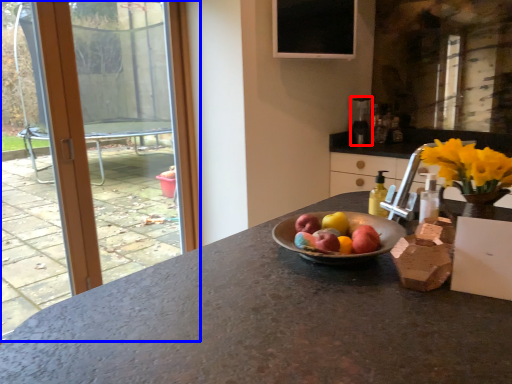
Question: Which point is closer to the camera, appliance (highlighted by a red box) or window (highlighted by a blue box)?

Choices:
 (A) appliance
 (B) window

Answer: (B)